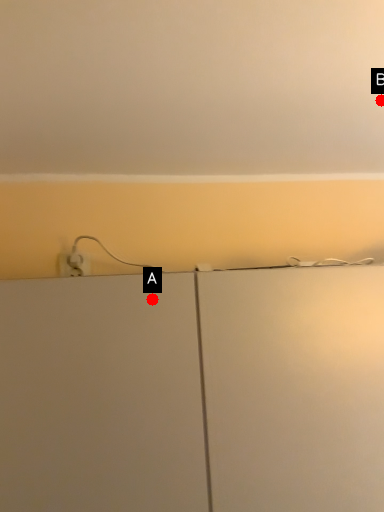
Question: Two points are circled on the image, labeled by A and B beside each circle. Among these points, which one is nearest to the camera?

Choices:
 (A) A is closer
 (B) B is closer

Answer: (A)